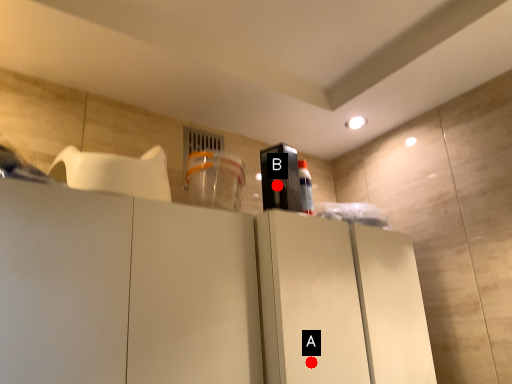
Question: Two points are circled on the image, labeled by A and B beside each circle. Which point is further to the camera?

Choices:
 (A) A is further
 (B) B is further

Answer: (B)